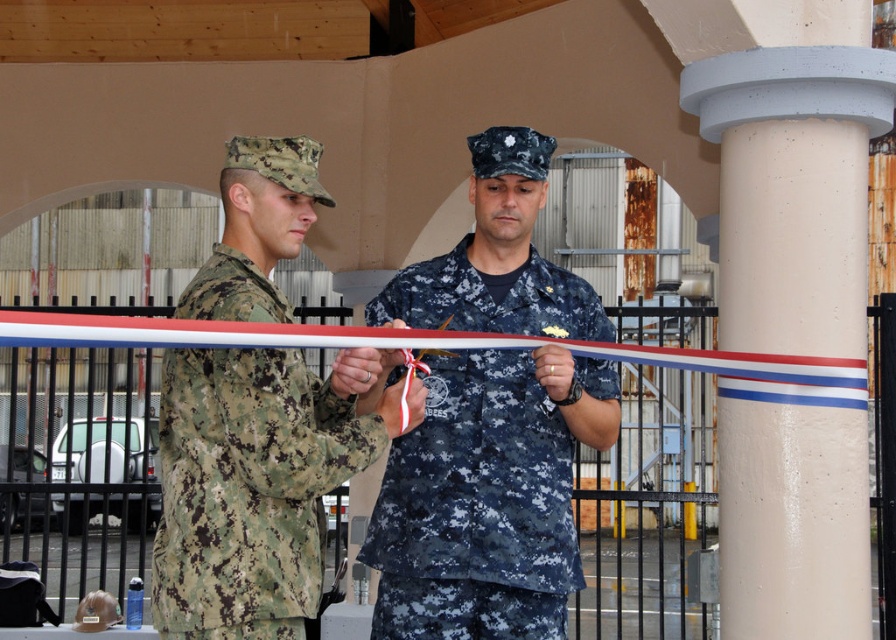
You are a photographer at the ribbon cutting ceremony. You need to take a photo of both the navy blue camouflage uniform at center and the camouflage fabric uniform at left. Which one will appear closer to the camera in the photo?

The navy blue camouflage uniform at center will appear closer to the camera because it is further to the viewer than the camouflage fabric uniform at left.

You are standing at the entrance of the ceremony area and see the white concrete pillar at center and the camouflage fabric uniform at left. Which object is closer to your right side?

The white concrete pillar at center is to the right of the camouflage fabric uniform at left, so the white concrete pillar at center is closer to your right side.